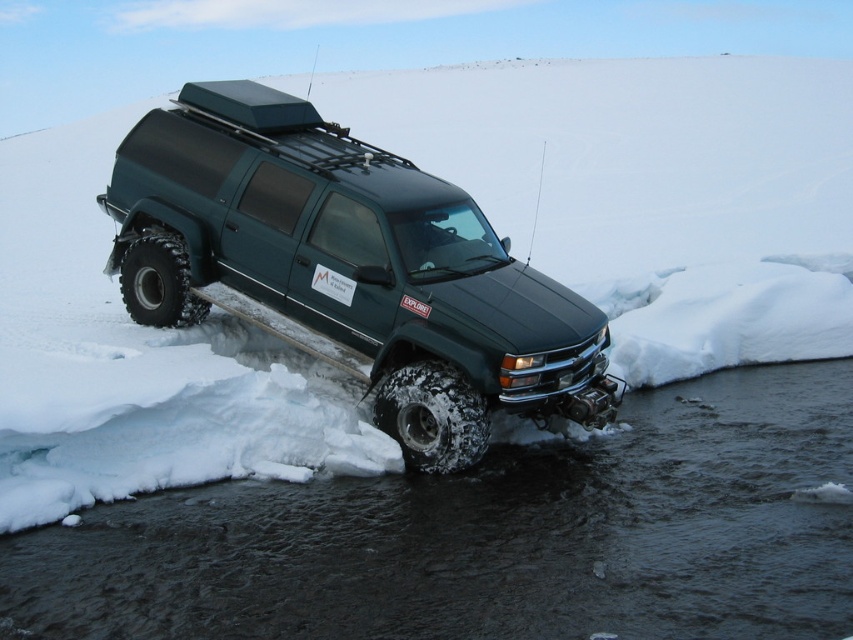
You are the driver of the dark green pickup truck in the snowy landscape. You notice two points marked on your GPS navigation system. The first point is labeled as point (x=788, y=449) and the second is point (x=202, y=124). According to the map, which point is closer to your current location?

Point (x=202, y=124) is closer to your current location because it is behind point (x=788, y=449), which is in front of it.

You are a passenger in the green matte truck at center. Looking out the window, you see the dark gray water at lower center. Is the water closer to you or farther away than the truck?

The dark gray water at lower center is closer to the viewer than the green matte truck at center, so the water is closer to you than the truck.

You are a hiker planning to cross the frozen river near the dark green pickup truck. The truck is driving over a point marked as point (492, 536). Based on the scene, can you determine if the dark gray water at lower center is safe to walk on?

The point (492, 536) indicates dark gray water at lower center, which is described as exposed dark water indicating a frozen river or stream. Since the truck is driving over it, it suggests the ice is thick enough to support the vehicle, so it is likely safe for a hiker to walk on.